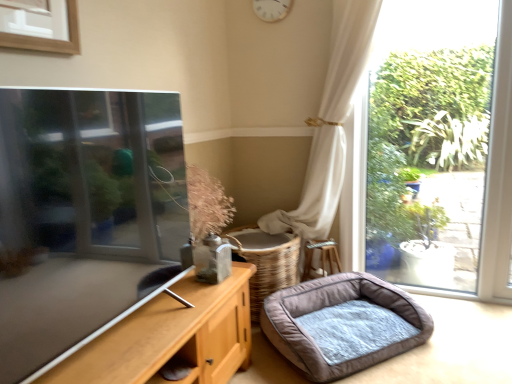
Identify the location of white wooden clock at upper center. (272, 9).

Describe the element at coordinates (272, 9) in the screenshot. This screenshot has height=384, width=512. I see `white wooden clock at upper center` at that location.

Describe the element at coordinates (340, 325) in the screenshot. I see `gray plush dog bed at lower right` at that location.

Identify the location of gray plush dog bed at lower right. This screenshot has height=384, width=512. (340, 325).

The image size is (512, 384). Find the location of `white wooden clock at upper center`. white wooden clock at upper center is located at coordinates (272, 9).

Considering the relative positions of gray plush dog bed at lower right and white wooden clock at upper center in the image provided, is gray plush dog bed at lower right to the left of white wooden clock at upper center from the viewer's perspective?

No, gray plush dog bed at lower right is not to the left of white wooden clock at upper center.

Does gray plush dog bed at lower right come in front of white wooden clock at upper center?

Yes, it is in front of white wooden clock at upper center.

Is point (394, 311) positioned in front of point (266, 14)?

Yes, point (394, 311) is in front of point (266, 14).

From the image's perspective, is gray plush dog bed at lower right under white wooden clock at upper center?

Correct, gray plush dog bed at lower right appears lower than white wooden clock at upper center in the image.

From a real-world perspective, which object stands above the other?

In real-world perspective, white wooden clock at upper center is above.

In terms of width, does gray plush dog bed at lower right look wider or thinner when compared to white wooden clock at upper center?

gray plush dog bed at lower right is wider than white wooden clock at upper center.

Can you confirm if gray plush dog bed at lower right is taller than white wooden clock at upper center?

Incorrect, the height of gray plush dog bed at lower right is not larger of that of white wooden clock at upper center.

Considering the relative sizes of gray plush dog bed at lower right and white wooden clock at upper center in the image provided, is gray plush dog bed at lower right smaller than white wooden clock at upper center?

Actually, gray plush dog bed at lower right might be larger than white wooden clock at upper center.

Is gray plush dog bed at lower right inside the boundaries of white wooden clock at upper center, or outside?

gray plush dog bed at lower right exists outside the volume of white wooden clock at upper center.

Are gray plush dog bed at lower right and white wooden clock at upper center located far from each other?

Yes.

Is gray plush dog bed at lower right facing away from white wooden clock at upper center?

gray plush dog bed at lower right does not have its back to white wooden clock at upper center.

You are a GUI agent. You are given a task and a screenshot of the screen. Output one action in this format:
    pyautogui.click(x=<x>, y=<y>)
    Task: Click on the dog bed in front of the white wooden clock at upper center
    
    Given the screenshot: What is the action you would take?
    pyautogui.click(x=340, y=325)

In the image, is white wooden clock at upper center on the left side or the right side of gray plush dog bed at lower right?

Based on their positions, white wooden clock at upper center is located to the left of gray plush dog bed at lower right.

In the image, is white wooden clock at upper center positioned in front of or behind gray plush dog bed at lower right?

white wooden clock at upper center is positioned farther from the viewer than gray plush dog bed at lower right.

In the scene shown: Which is less distant, (277,12) or (362,338)?

Positioned in front is point (362,338).

From the image's perspective, is white wooden clock at upper center over gray plush dog bed at lower right?

Yes, from the image's perspective, white wooden clock at upper center is above gray plush dog bed at lower right.

From a real-world perspective, which object stands above the other?

From a 3D spatial view, white wooden clock at upper center is above.

Which object is wider, white wooden clock at upper center or gray plush dog bed at lower right?

gray plush dog bed at lower right.

Considering the sizes of white wooden clock at upper center and gray plush dog bed at lower right in the image, is white wooden clock at upper center taller or shorter than gray plush dog bed at lower right?

Clearly, white wooden clock at upper center is taller compared to gray plush dog bed at lower right.

In the scene shown: Looking at the image, does white wooden clock at upper center seem bigger or smaller compared to gray plush dog bed at lower right?

Considering their sizes, white wooden clock at upper center takes up less space than gray plush dog bed at lower right.

Is white wooden clock at upper center situated inside gray plush dog bed at lower right or outside?

white wooden clock at upper center is outside gray plush dog bed at lower right.

Is white wooden clock at upper center not close to gray plush dog bed at lower right?

That's right, there is a large distance between white wooden clock at upper center and gray plush dog bed at lower right.

Is white wooden clock at upper center looking in the opposite direction of gray plush dog bed at lower right?

No, white wooden clock at upper center is not facing away from gray plush dog bed at lower right.

Can you tell me how much white wooden clock at upper center and gray plush dog bed at lower right differ in facing direction?

The facing directions of white wooden clock at upper center and gray plush dog bed at lower right are 51 degrees apart.

Locate an element on the screen. Image resolution: width=512 pixels, height=384 pixels. clock that appears above the gray plush dog bed at lower right (from the image's perspective) is located at coordinates (272, 9).

Image resolution: width=512 pixels, height=384 pixels. I want to click on clock above the gray plush dog bed at lower right (from the image's perspective), so click(272, 9).

Locate an element on the screen. The image size is (512, 384). dog bed to the right of white wooden clock at upper center is located at coordinates (340, 325).